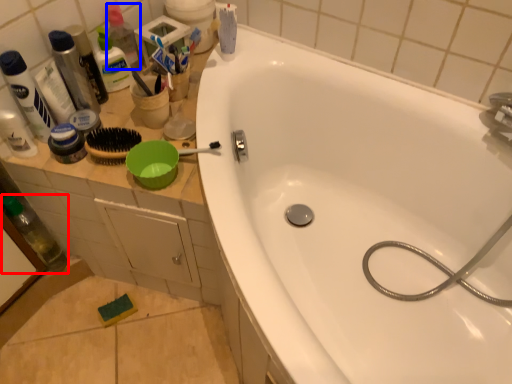
Question: Which object is closer to the camera taking this photo, bottle (highlighted by a red box) or bottle (highlighted by a blue box)?

Choices:
 (A) bottle
 (B) bottle

Answer: (A)